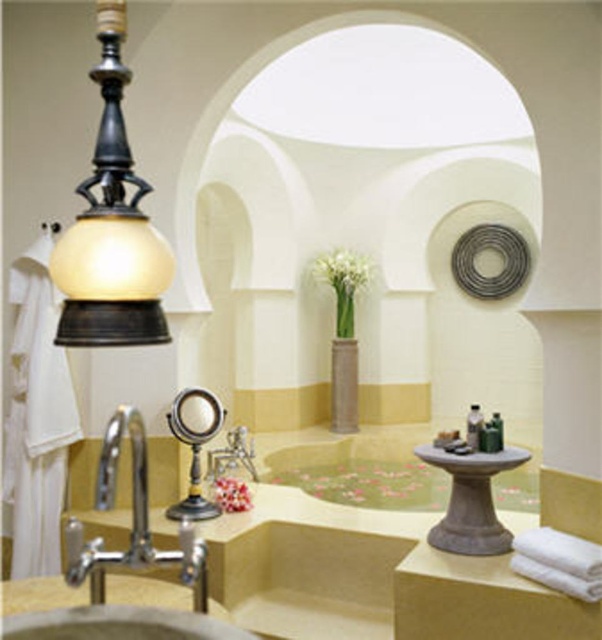
Which is more to the right, matte black lamp at left or matte stone pillar at center?

From the viewer's perspective, matte stone pillar at center appears more on the right side.

Who is more distant from viewer, (x=63, y=301) or (x=330, y=397)?

The point (x=330, y=397) is behind.

Identify the location of matte black lamp at left. (111, 227).

Between satin nickel sink at lower left and matte stone pillar at center, which one has less height?

Standing shorter between the two is satin nickel sink at lower left.

Who is higher up, satin nickel sink at lower left or matte stone pillar at center?

matte stone pillar at center

Which is behind, point (138, 634) or point (355, 348)?

The point (355, 348) is behind.

This screenshot has height=640, width=602. Identify the location of satin nickel sink at lower left. (119, 625).

Is smooth stone bath at center smaller than satin nickel sink at lower left?

No.

Which is behind, point (284, 476) or point (113, 612)?

The point (284, 476) is behind.

Who is more forward, (535, 509) or (46, 621)?

Point (46, 621) is more forward.

Find the location of a particular element. smooth stone bath at center is located at coordinates (361, 472).